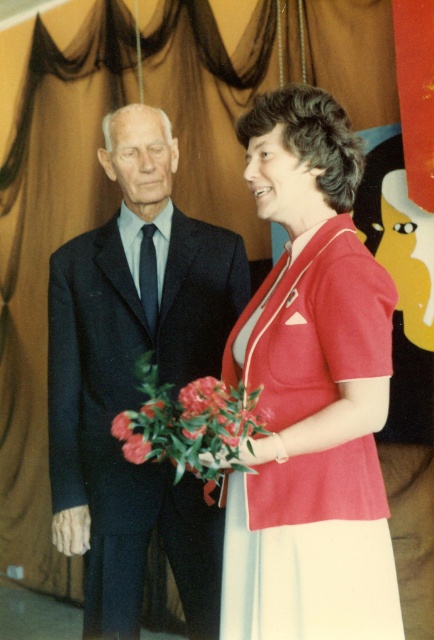
Between vivid red petals at center and fluffy pink rose at center, which one has less height?

fluffy pink rose at center

Can you confirm if vivid red petals at center is shorter than fluffy pink rose at center?

In fact, vivid red petals at center may be taller than fluffy pink rose at center.

The image size is (434, 640). What do you see at coordinates (197, 424) in the screenshot? I see `vivid red petals at center` at bounding box center [197, 424].

At what (x,y) coordinates should I click in order to perform the action: click on vivid red petals at center. Please return your answer as a coordinate pair (x, y). The width and height of the screenshot is (434, 640). Looking at the image, I should click on (197, 424).

Which of these two, matte black suit at left or glossy floral bouquet at center, stands shorter?

glossy floral bouquet at center

How distant is matte black suit at left from glossy floral bouquet at center?

They are 26.23 inches apart.

Is point (150, 483) positioned before point (199, 401)?

No, (150, 483) is behind (199, 401).

Find the location of a particular element. This screenshot has height=640, width=434. matte black suit at left is located at coordinates (134, 380).

Between vivid red petals at center and vivid pink petals at lower left, which one is positioned lower?

Positioned lower is vivid pink petals at lower left.

Who is more distant from viewer, (200, 380) or (138, 460)?

Positioned behind is point (200, 380).

Find the location of a particular element. vivid red petals at center is located at coordinates (197, 424).